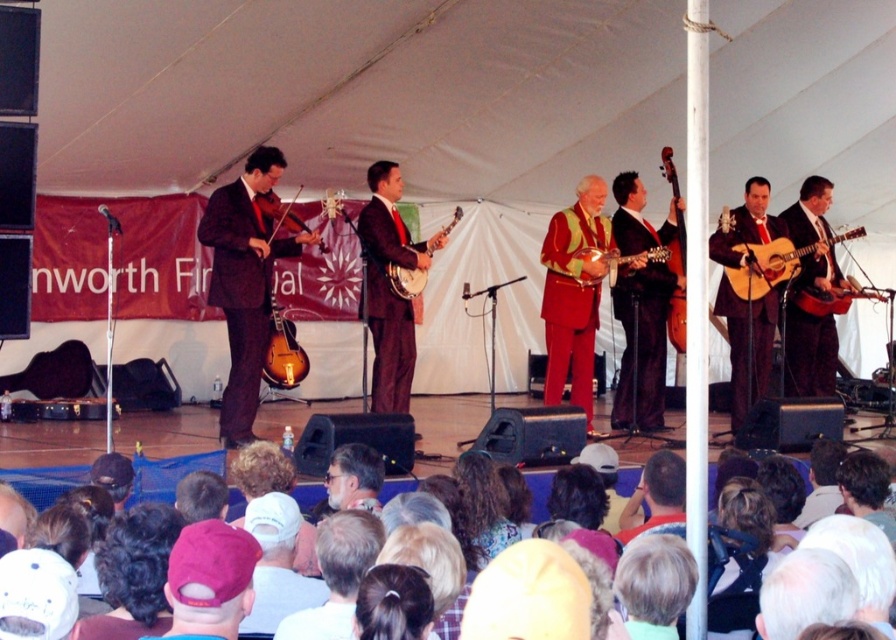
Where is the matte brown guitar at center located in the image?

The matte brown guitar at center is located at point coordinates of approximately 0.469 on the x axis and 0.831 on the y axis.

You are a photographer at the live music performance. You want to take a photo of the velvet red suit at center. What are the coordinates where you should focus your camera?

The velvet red suit at center is located at coordinates point (573, 294).

You are a photographer at the event and want to take a photo of the pink fabric cap at lower left without the matte brown guitar at center blocking it. What should you do?

The pink fabric cap at lower left is behind the matte brown guitar at center, so you should move your position to the side or behind the guitar to capture the cap without obstruction.